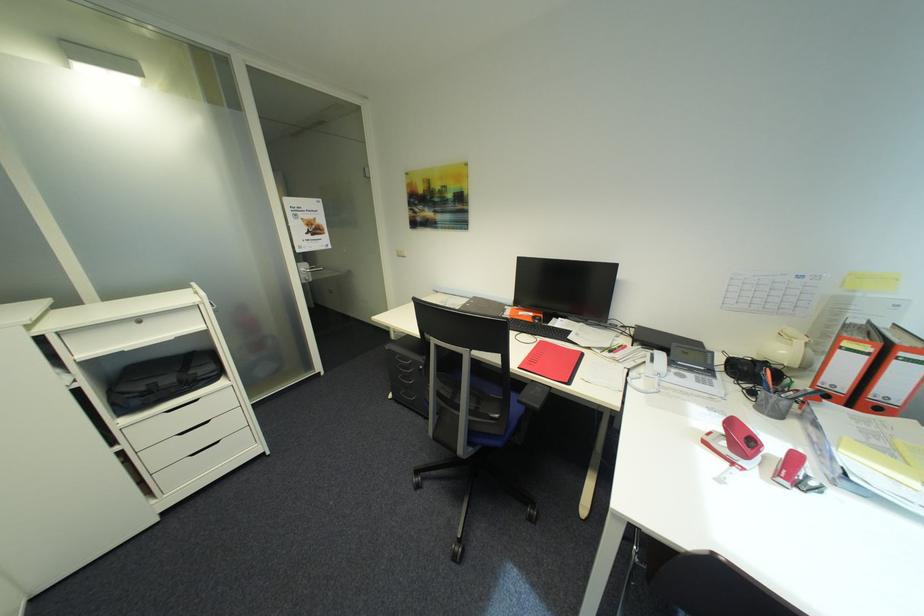
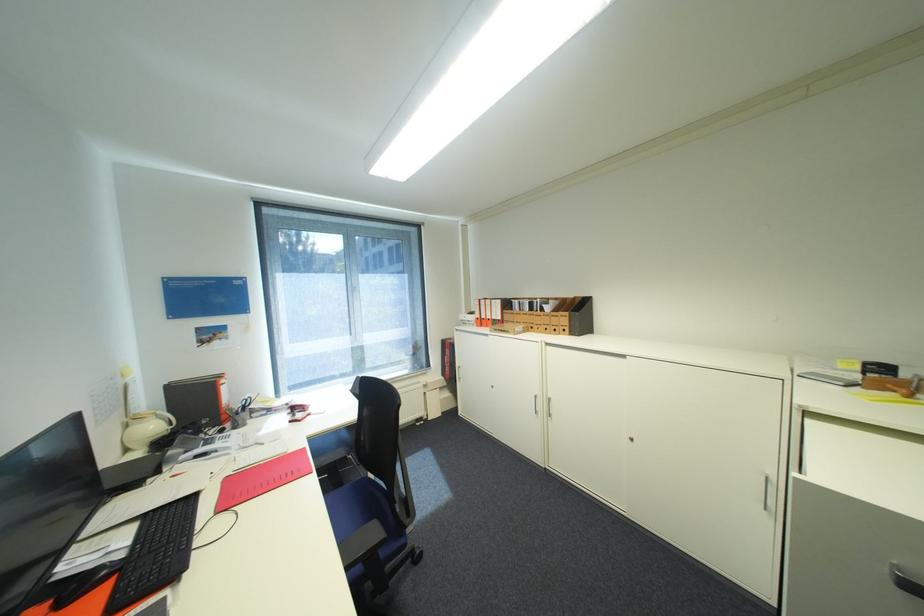
Where in the second image is the point corresponding to (x=793, y=353) from the first image?

(161, 427)